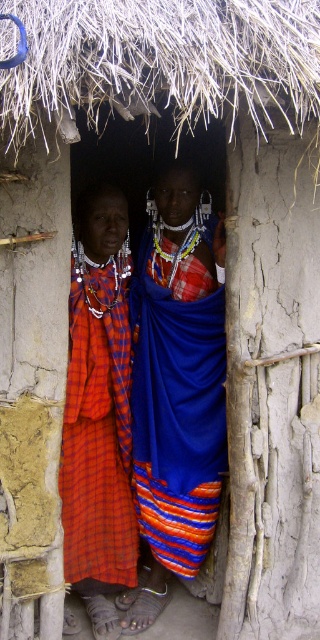
You are a photographer setting up a shoot inside the rustic hut. You need to position a tripod between the blue woven cloth at center and the plaid fabric skirt at left. Since the tripod requires a flat surface, will the space between them be sufficient if the minimum required distance is 30 cm?

The blue woven cloth at center is not as tall as plaid fabric skirt at left, but the description does not provide information about the distance between them. Therefore, it is impossible to determine if the space between them is sufficient for the tripod.